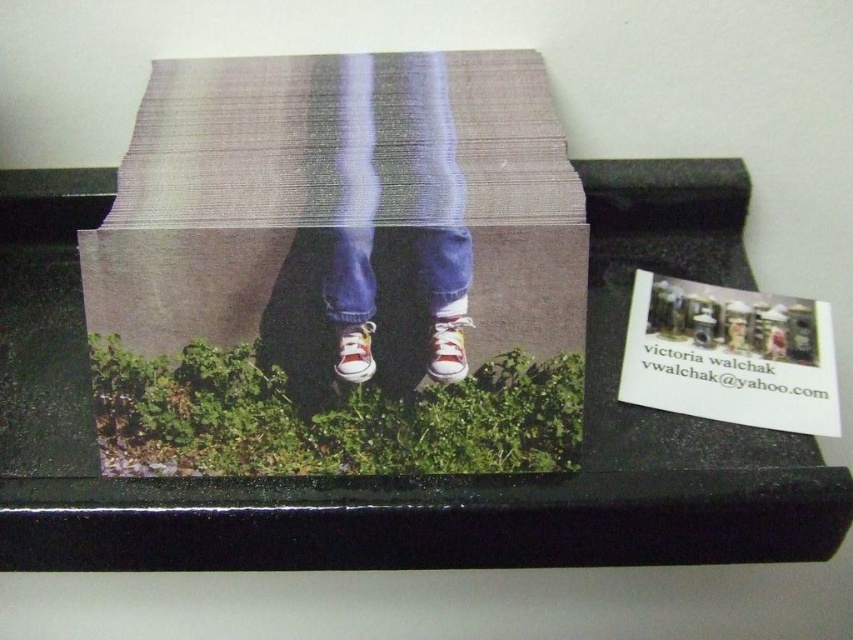
You are organizing a storage room and need to retrieve the matte canvas pants at center. However, the matte cardboard box at center is blocking access to it. Can you move the box to get to the pants?

The matte cardboard box at center is in front of the matte canvas pants at center, so you can move the box to access the pants.

You are looking at the image of the photograph and the business card. Which of the two points, point (349,145) or point (370,328), is closer to you?

Point (349,145) is closer to you than point (370,328).

You are organizing a small art exhibition and have a matte cardboard box at center and a matte canvas pants at center on your desk. You need to place a 3.5 inch wide sculpture between them. Will there be enough space?

The matte cardboard box at center and matte canvas pants at center are 2.44 inches apart. Since the sculpture is 3.5 inches wide, there isn t enough space between them to fit the sculpture.